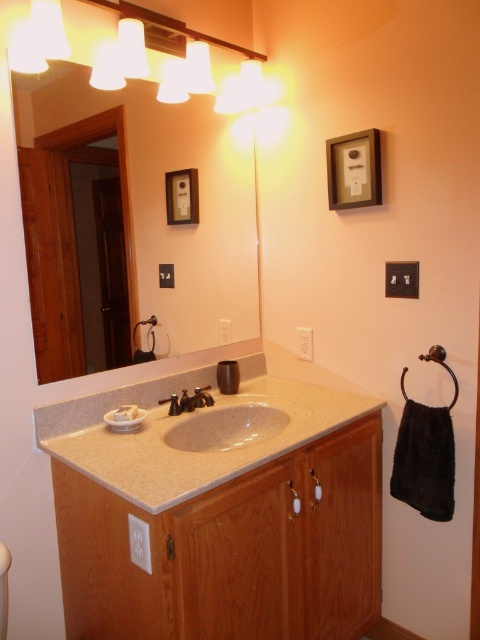
Where is the beige granite sink at center located in the bathroom?

The beige granite sink at center is located at point (192, 432) in the bathroom.

You are standing in front of the bathroom vanity. You need to place a decorative item between the beige granite sink at center and the matte plastic picture frame at upper center. Which object should you place it closer to if you want it to be more visible to someone entering the room?

You should place the decorative item closer to the beige granite sink at center because it is closer to the viewer, making it more visible to someone entering the room compared to the matte plastic picture frame at upper center which is further away.

You are standing in front of the bathroom vanity and see two points marked on the wall above the sink. The first point is at coordinates point (228, 436) and the second is at point (369, 148). If you want to hang a picture between them so that it is closer to the back wall, which point should you use as the anchor?

Point (228, 436) is behind point (369, 148), so you should anchor the picture at point (228, 436) to place it closer to the back wall.